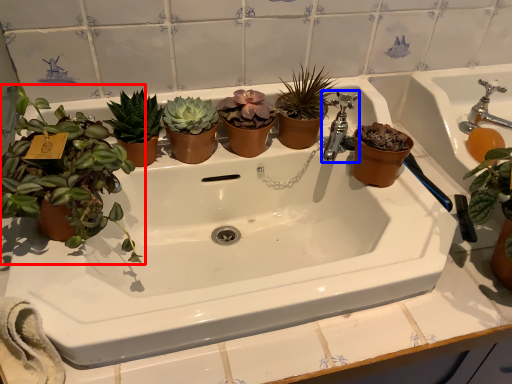
Question: Which object is further to the camera taking this photo, houseplant (highlighted by a red box) or tap (highlighted by a blue box)?

Choices:
 (A) houseplant
 (B) tap

Answer: (B)